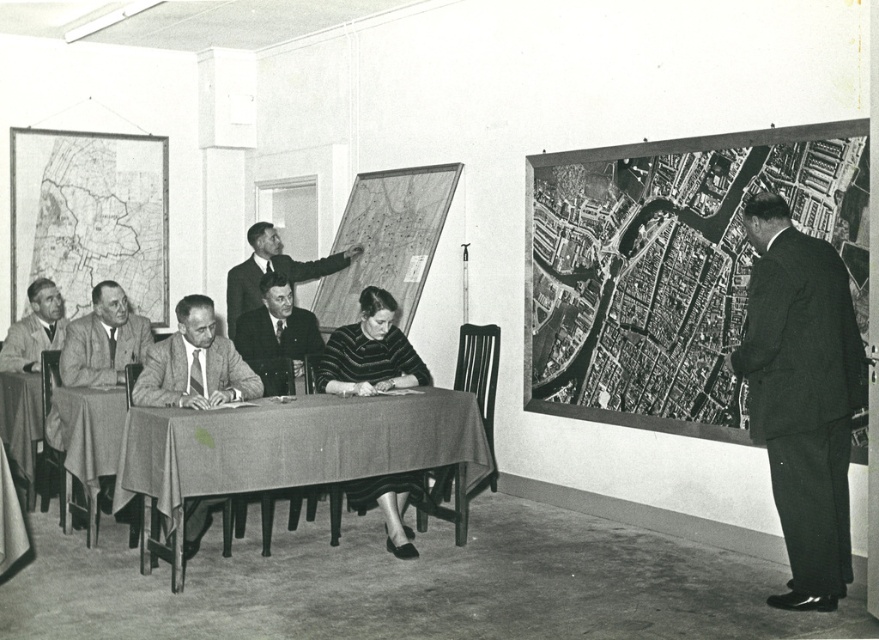
You are standing in the conference room and need to locate two specific points on the maps displayed on the walls. The first point is at coordinates point (342, 339) and the second is at point (292, 310). Which of these points is closer to you when facing the maps?

Point (342, 339) is in front of point (292, 310), so it is closer to you when facing the maps.

You are organizing a small presentation and need to place a striped sweater at center on the textured fabric table at center. Will the sweater fit on the table?

The textured fabric table at center might be wider than striped sweater at center, so the sweater should fit on the table.